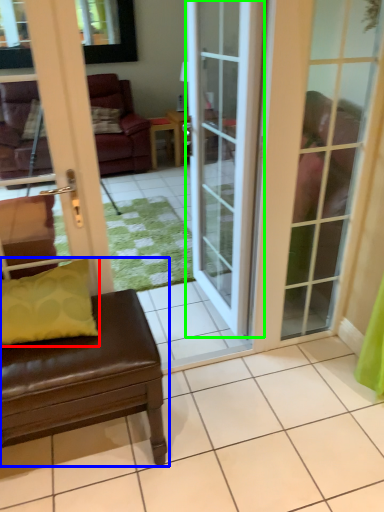
Question: Which object is positioned closest to pillow (highlighted by a red box)? Select from studio couch (highlighted by a blue box) and door (highlighted by a green box).

Choices:
 (A) studio couch
 (B) door

Answer: (A)